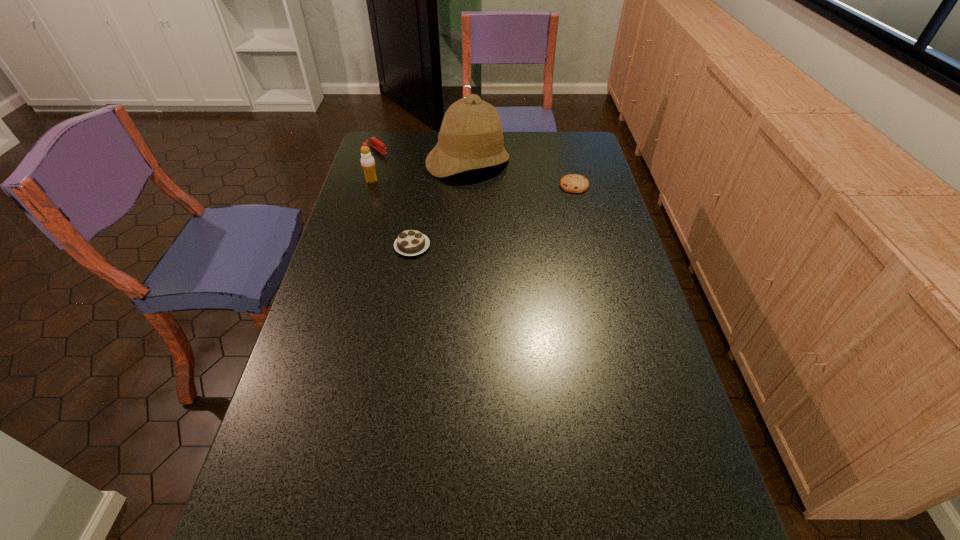
Identify the location of free space between the icecream and the stapler. This screenshot has height=540, width=960. (375, 165).

The image size is (960, 540). What are the coordinates of `empty space that is in between the tallest object and the chocolate cake` in the screenshot? It's located at (x=440, y=204).

This screenshot has width=960, height=540. I want to click on vacant area between the chocolate cake and the hat, so click(x=440, y=204).

Identify the location of free space between the chocolate cake and the shortest object. Image resolution: width=960 pixels, height=540 pixels. (493, 215).

The width and height of the screenshot is (960, 540). I want to click on free space between the tallest object and the nearest object, so click(440, 204).

Where is `empty space between the hat and the chocolate cake`? empty space between the hat and the chocolate cake is located at coordinates tap(440, 204).

Where is `vacant space that's between the second tallest object and the tallest object`? Image resolution: width=960 pixels, height=540 pixels. vacant space that's between the second tallest object and the tallest object is located at coordinates (420, 172).

Identify the location of object that is the second closest one to the shortest object. (410, 242).

Identify which object is the closest to the stapler. Please provide its 2D coordinates. Your answer should be formatted as a tuple, i.e. [(x, y)], where the tuple contains the x and y coordinates of a point satisfying the conditions above.

[(367, 161)]

Find the location of a particular element. This screenshot has width=960, height=540. free spot that satisfies the following two spatial constraints: 1. on the front side of the nearest object; 2. on the right side of the icecream is located at coordinates (352, 246).